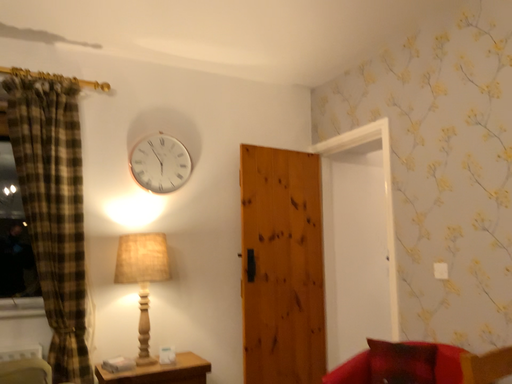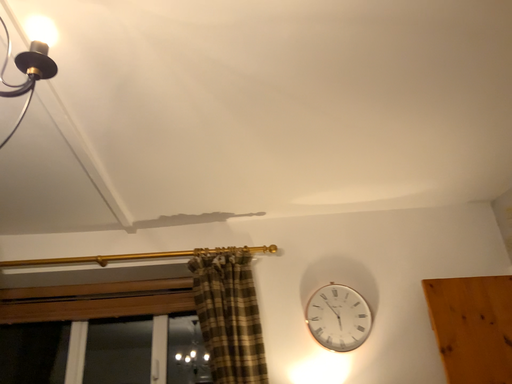
Question: Which way did the camera rotate in the video?

Choices:
 (A) rotated right
 (B) rotated left

Answer: (B)